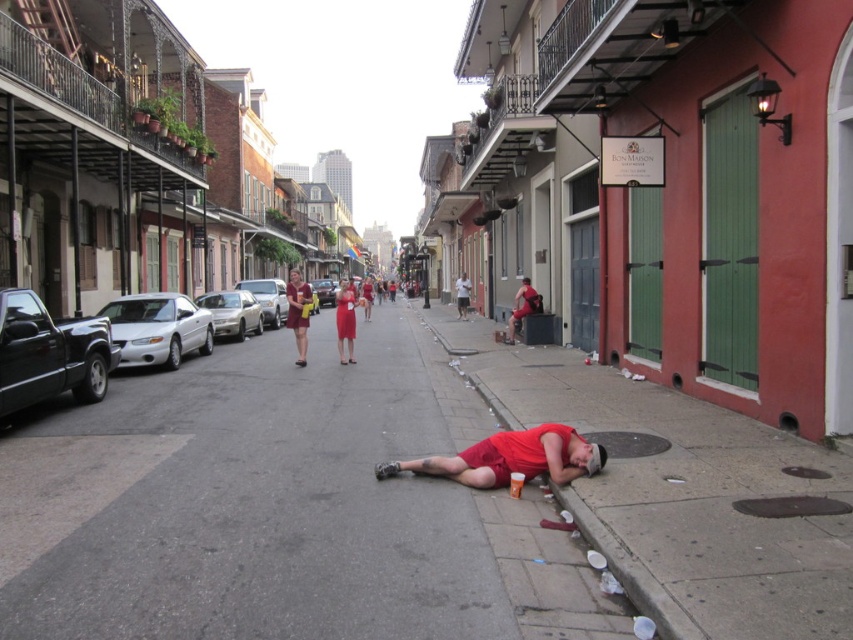
Question: Does matte red shorts at lower center lie in front of maroon dress at center?

Choices:
 (A) no
 (B) yes

Answer: (B)

Question: Which of the following is the farthest from the observer?

Choices:
 (A) (x=456, y=291)
 (B) (x=529, y=289)
 (C) (x=311, y=301)

Answer: (A)

Question: Is gray asphalt at center below matte red shorts at center?

Choices:
 (A) no
 (B) yes

Answer: (B)

Question: Which object is closer to the camera taking this photo?

Choices:
 (A) gray asphalt at center
 (B) matte red shorts at lower center
 (C) white cotton t-shirt at center

Answer: (A)

Question: Among these points, which one is nearest to the camera?

Choices:
 (A) (509, 337)
 (B) (4, 580)

Answer: (B)

Question: Does matte red shorts at lower center appear under white cotton t-shirt at center?

Choices:
 (A) no
 (B) yes

Answer: (B)